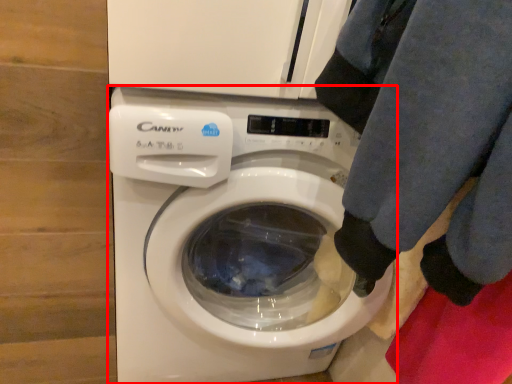
Question: From the image's perspective, where is washing machine (annotated by the red box) located in relation to clothing in the image?

Choices:
 (A) above
 (B) below

Answer: (B)